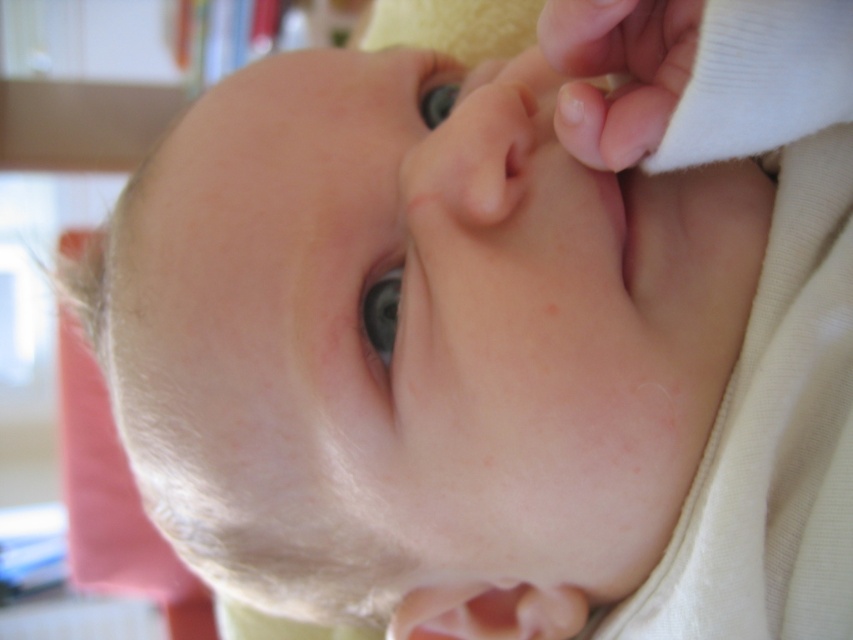
Which is above, smooth skin hand at upper right or blue glossy eye at center?

smooth skin hand at upper right is higher up.

From the picture: Measure the distance between point (602, 3) and camera.

Point (602, 3) is 14.35 inches away from camera.

Is point (675, 99) closer to camera compared to point (384, 280)?

Yes, point (675, 99) is in front of point (384, 280).

Where is `smooth skin hand at upper right`? smooth skin hand at upper right is located at coordinates (618, 72).

Which is above, smooth skin hand at upper right or smooth flesh nose at center?

smooth skin hand at upper right is above.

Who is positioned more to the left, smooth skin hand at upper right or smooth flesh nose at center?

smooth flesh nose at center

Find the location of `smooth skin hand at upper right`. smooth skin hand at upper right is located at coordinates (618, 72).

I want to click on smooth skin hand at upper right, so click(618, 72).

Is smooth flesh nose at center below blue glossy eye at center?

Incorrect, smooth flesh nose at center is not positioned below blue glossy eye at center.

Between smooth flesh nose at center and blue glossy eye at center, which one appears on the right side from the viewer's perspective?

smooth flesh nose at center is more to the right.

Is point (473, 129) farther from camera compared to point (395, 278)?

No, (473, 129) is closer to viewer.

The image size is (853, 640). What are the coordinates of `smooth flesh nose at center` in the screenshot? It's located at (473, 152).